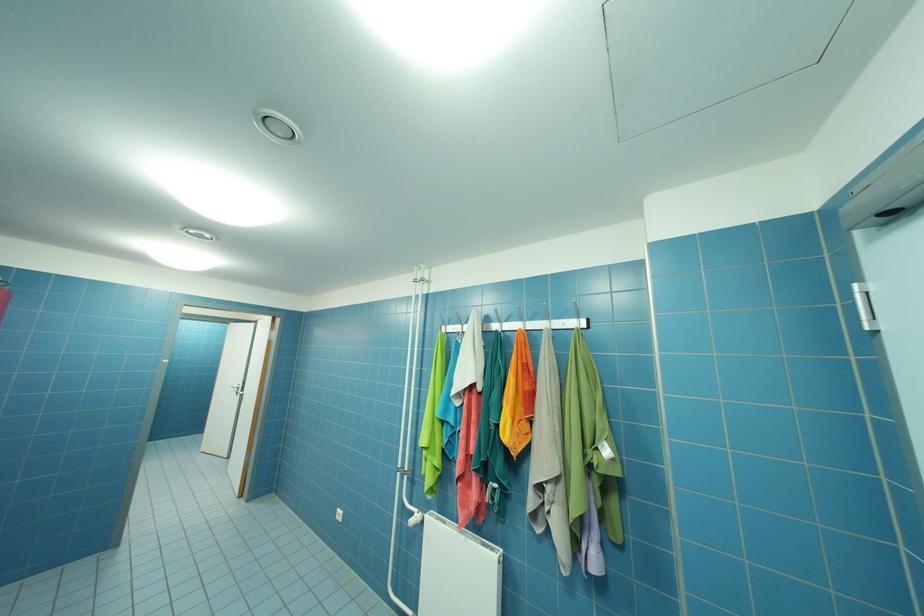
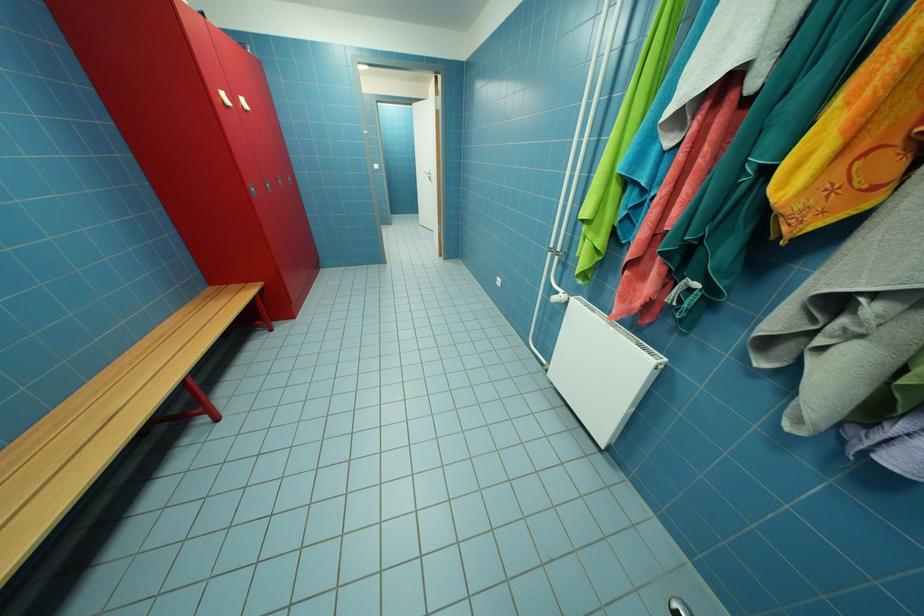
How did the camera likely rotate?

The rotation direction of the camera is left-down.